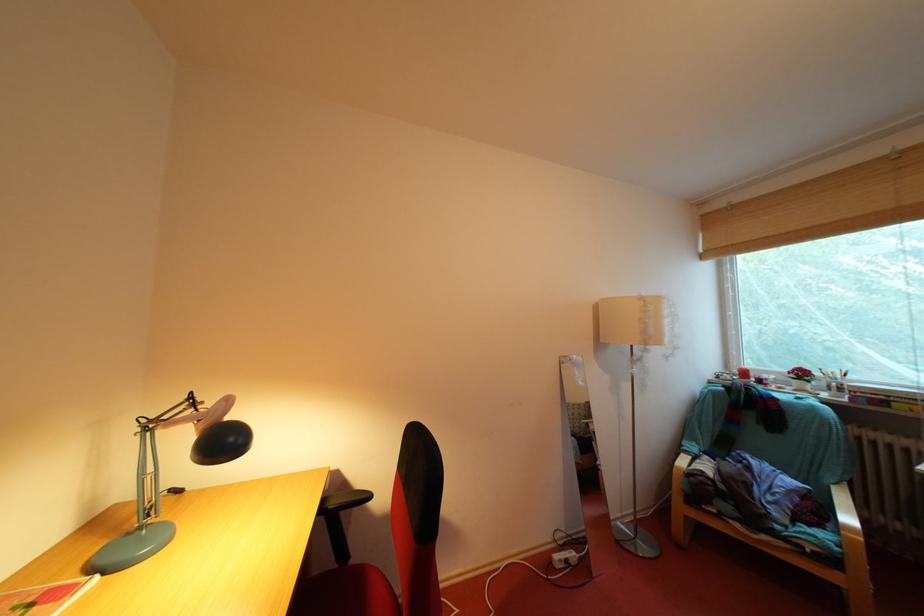
I want to click on red chair sitting surface, so click(357, 591).